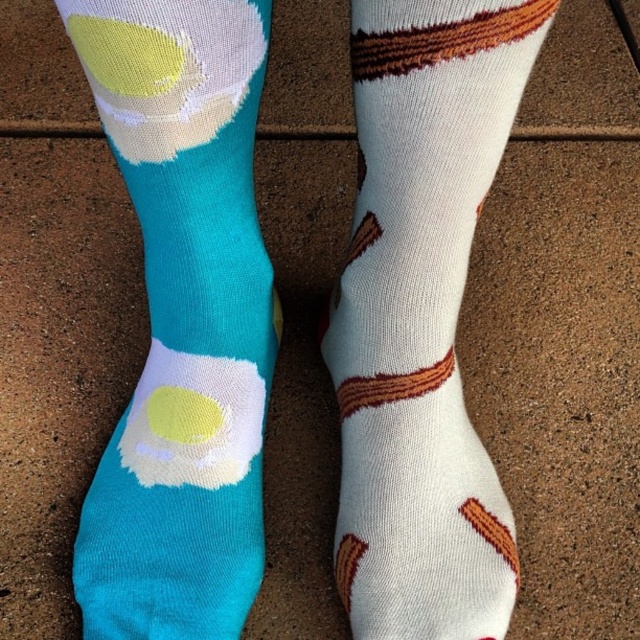
Between turquoise soft cotton socks at left and white cotton socks with brown stripes at right, which one appears on the left side from the viewer's perspective?

From the viewer's perspective, turquoise soft cotton socks at left appears more on the left side.

Who is more forward, (x=180, y=113) or (x=460, y=451)?

Positioned in front is point (x=180, y=113).

I want to click on turquoise soft cotton socks at left, so click(x=182, y=321).